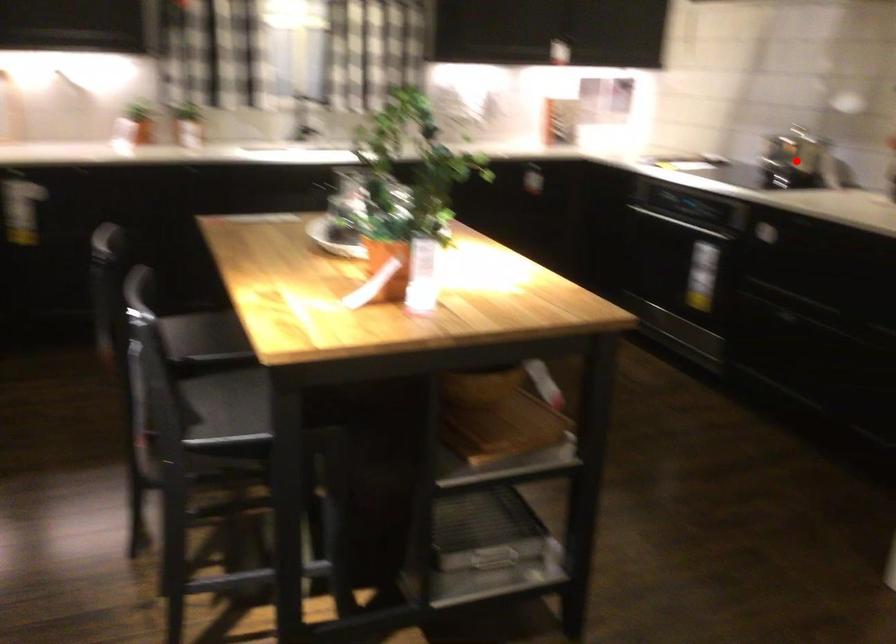
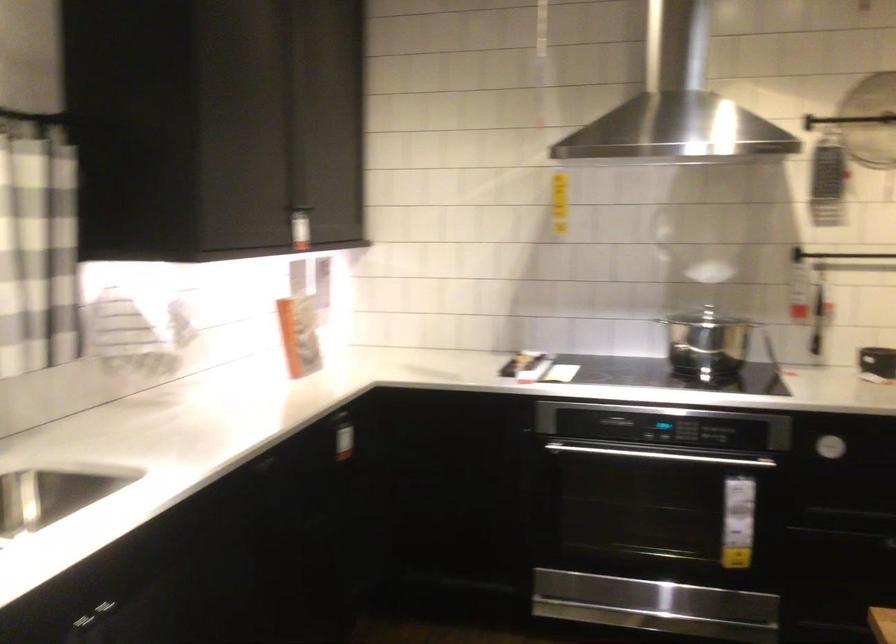
Question: I am providing you with two images of the same scene from different viewpoints. A red point is marked on the first image. Can you still see the location of the red point in image 2?

Choices:
 (A) Yes
 (B) No

Answer: (B)